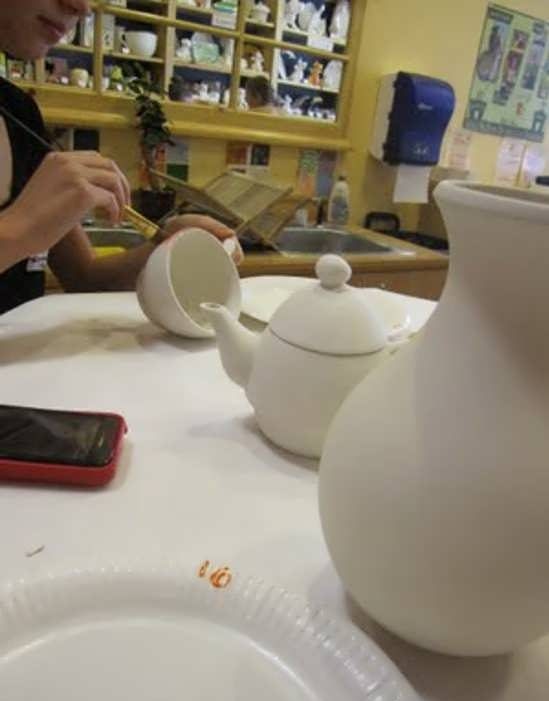
Where is `paper towel`? paper towel is located at coordinates (404, 183).